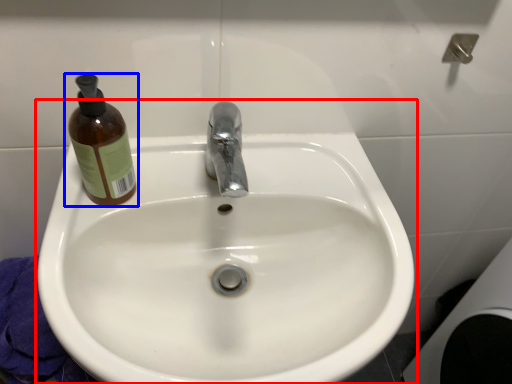
Question: Which point is closer to the camera, sink (highlighted by a red box) or bottle (highlighted by a blue box)?

Choices:
 (A) sink
 (B) bottle

Answer: (A)